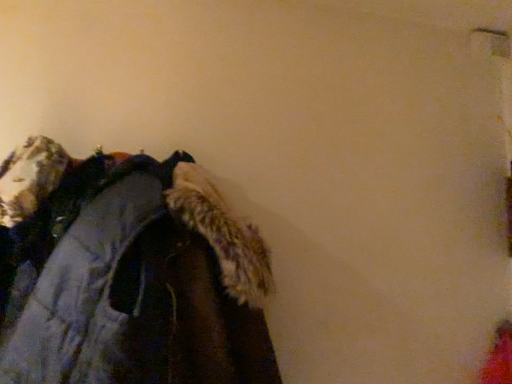
What do you see at coordinates (127, 274) in the screenshot?
I see `fuzzy fabric jacket at upper left` at bounding box center [127, 274].

Find the location of a particular element. fuzzy fabric jacket at upper left is located at coordinates (127, 274).

This screenshot has width=512, height=384. I want to click on fuzzy fabric jacket at upper left, so click(127, 274).